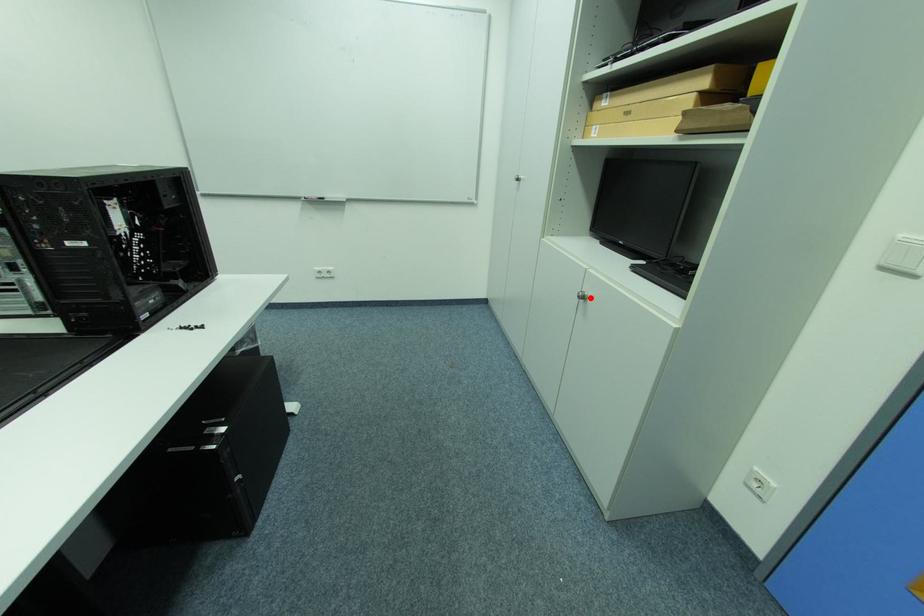
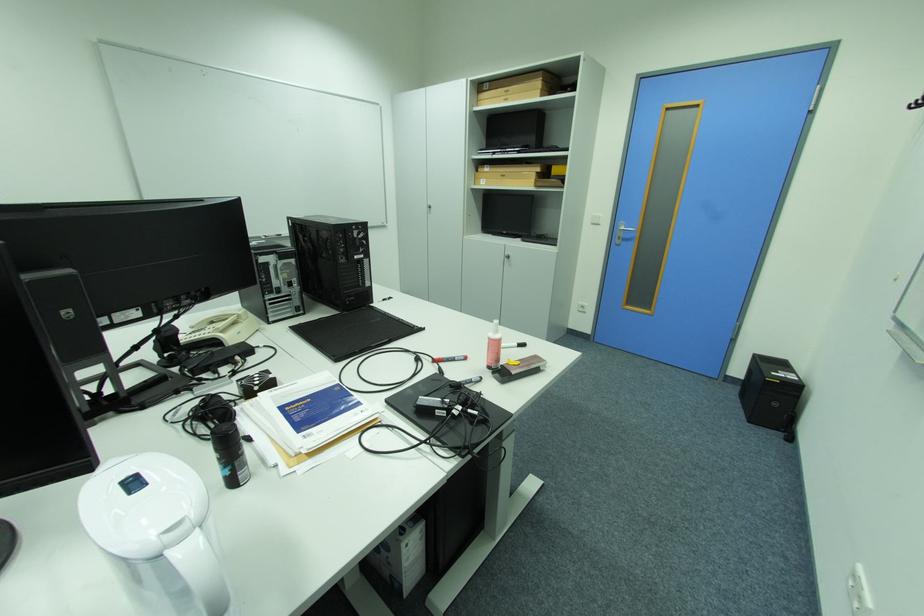
The point at the highlighted location is marked in the first image. Where is the corresponding point in the second image?

(516, 257)